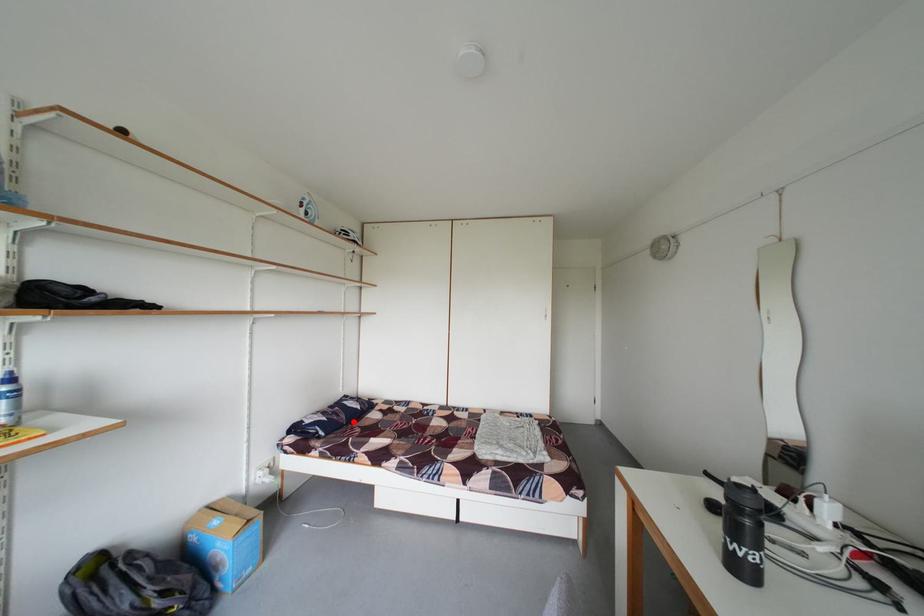
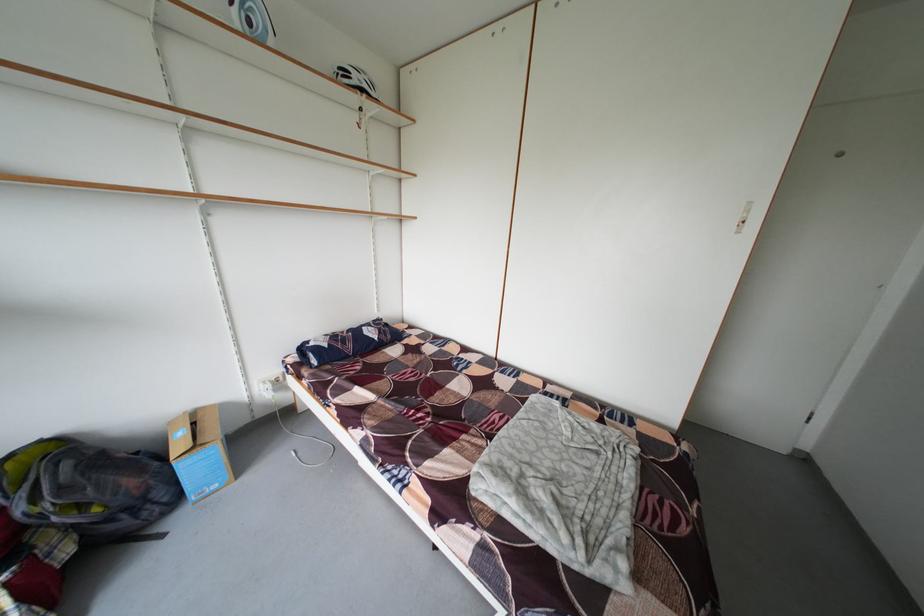
Find the pixel in the second image that matches the highlighted location in the first image.

(360, 351)